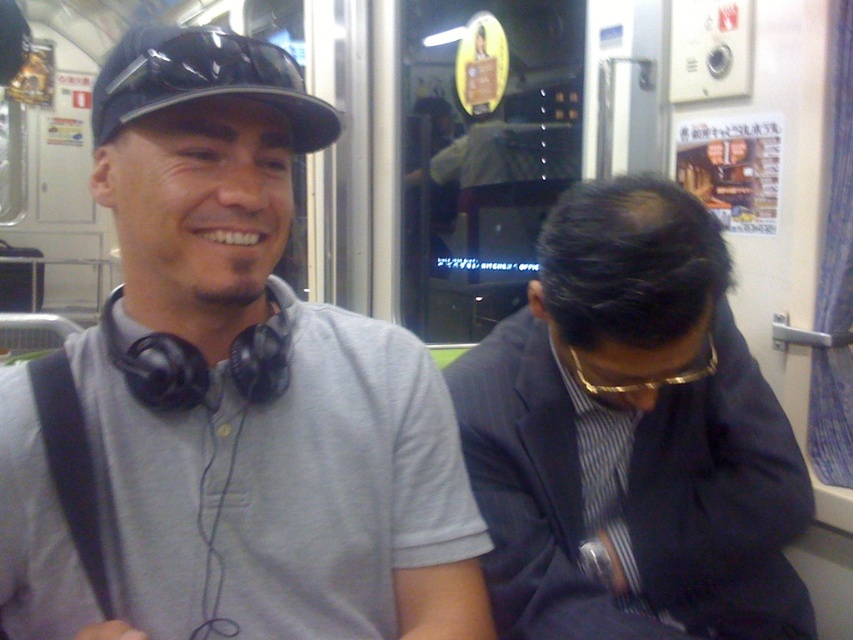
You are a photographer trying to capture both the gray matte shirt at center and the dark blue pinstripe suit at center in a single shot. Since you want to emphasize the smaller subject, which one should you focus on to ensure it stands out more?

You should focus on the gray matte shirt at center because it occupies less space than the dark blue pinstripe suit at center, making it the smaller subject to emphasize.

You are standing on the subway train and want to take a photo of the point at coordinates point (695, 556). Your camera has a focal length of 50mm and a sensor size of 24mm x 36mm. What is the minimum distance you need to be from the point to ensure the entire scene fits within the camera frame?

The point at coordinates point (695, 556) is 1.10 meters away from the camera. To ensure the entire scene fits within the camera frame, you need to maintain a distance of at least 1.10 meters from the point.

You are a photographer standing in the subway car and want to take a closeup shot of the dark blue pinstripe suit at center. The camera you are using has a minimum focusing distance of 30 inches. Can you take the photo without moving closer?

The dark blue pinstripe suit at center is 33.62 inches away from camera, which is beyond the camera minimum focusing distance of 30 inches. So yes, you can take the photo without moving closer.